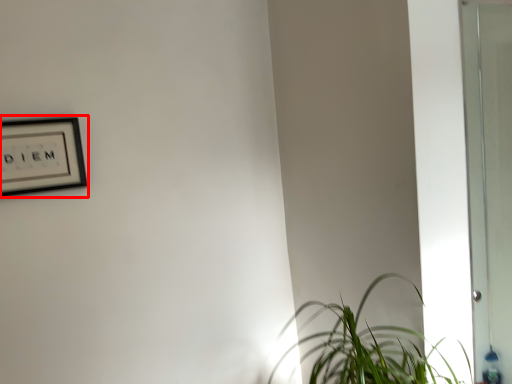
Question: Where is picture frame (annotated by the red box) located in relation to houseplant in the image?

Choices:
 (A) left
 (B) right

Answer: (A)